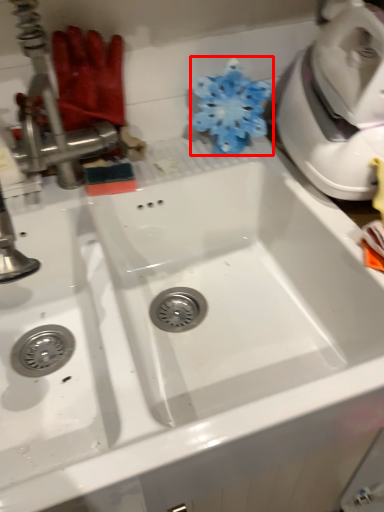
Question: From the image's perspective, what is the correct spatial positioning of flower (annotated by the red box) in reference to tap?

Choices:
 (A) above
 (B) below

Answer: (B)